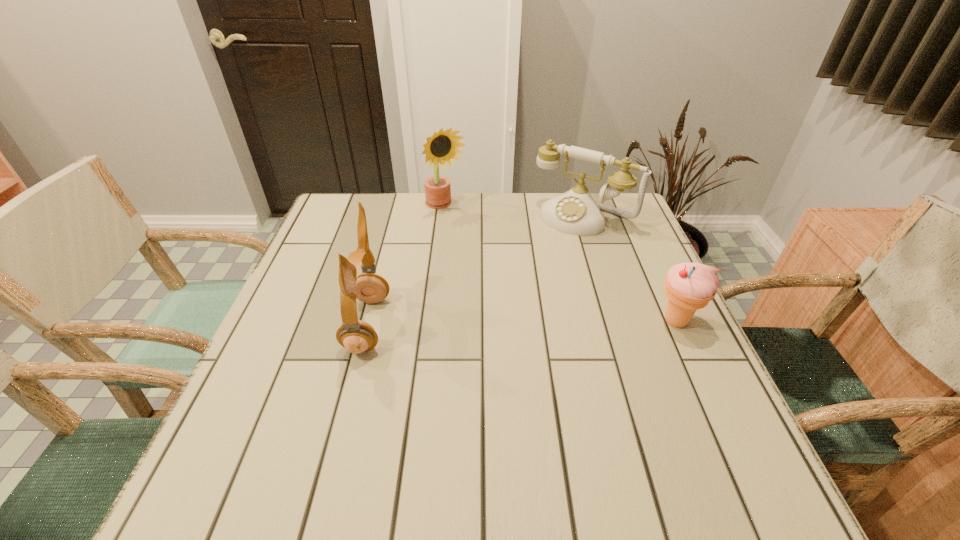
The height and width of the screenshot is (540, 960). In order to click on vacant space positioned 0.280m on the face of the sunflower in this screenshot , I will do `click(500, 274)`.

Locate an element on the screen. The width and height of the screenshot is (960, 540). free space located 0.260m on the face of the sunflower is located at coordinates (496, 269).

Locate an element on the screen. Image resolution: width=960 pixels, height=540 pixels. telephone that is at the far edge is located at coordinates (575, 212).

The height and width of the screenshot is (540, 960). Identify the location of sunflower located at the far edge. (442, 147).

Where is `icecream that is at the right edge`? icecream that is at the right edge is located at coordinates (689, 286).

Where is `telephone that is at the right edge`? telephone that is at the right edge is located at coordinates (575, 212).

Identify the location of object that is at the far right corner. This screenshot has height=540, width=960. [575, 212].

What are the coordinates of `free space at the far edge of the desktop` in the screenshot? It's located at (424, 204).

Find the location of a particular element. vacant space at the near edge of the desktop is located at coordinates (338, 427).

In the image, there is a desktop. What are the coordinates of `vacant space at the left edge` in the screenshot? It's located at (321, 354).